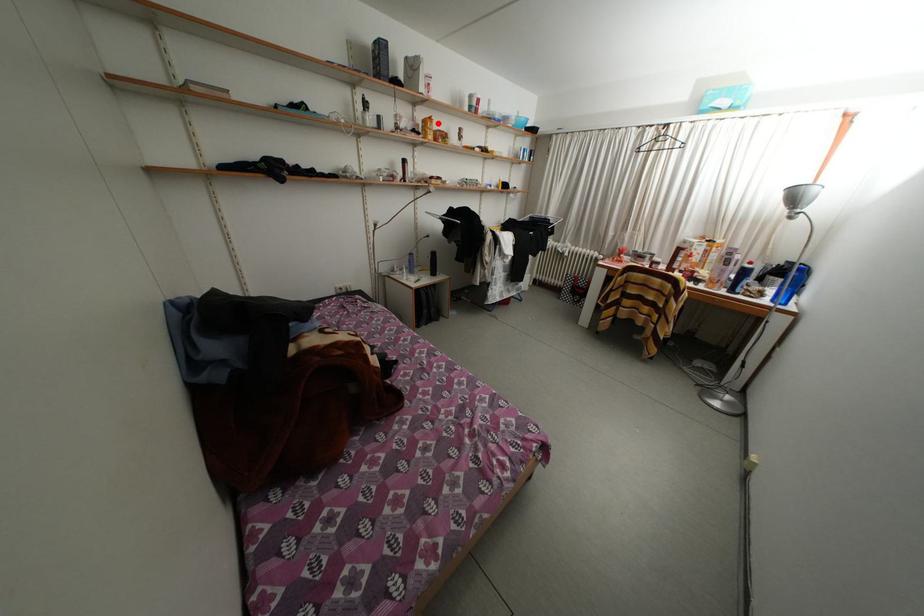
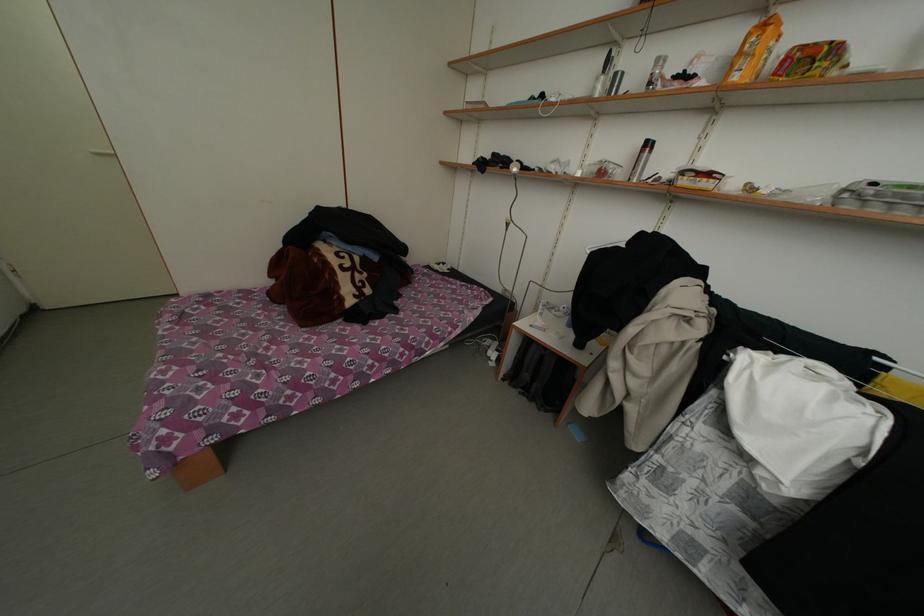
Question: I am providing you with two images of the same scene from different viewpoints. A red point is marked on the first image. Is the red point's position out of view in image 2?

Choices:
 (A) Yes
 (B) No

Answer: (B)